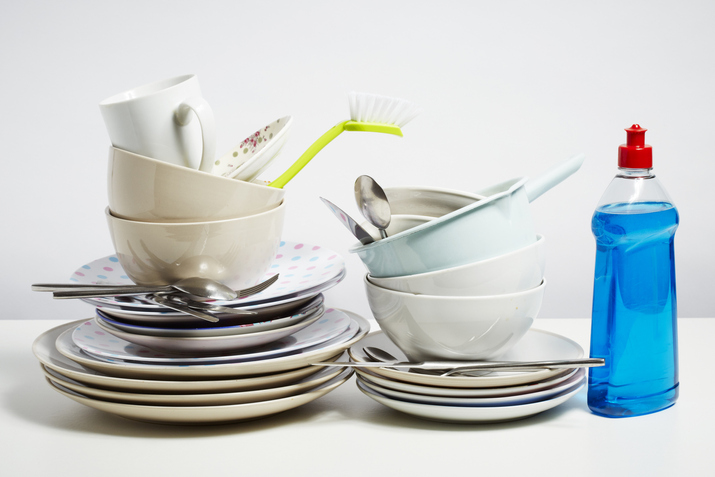
Image resolution: width=715 pixels, height=477 pixels. I want to click on bowl, so tap(162, 214), tap(177, 240), tap(427, 252), tap(468, 283), tap(473, 312).